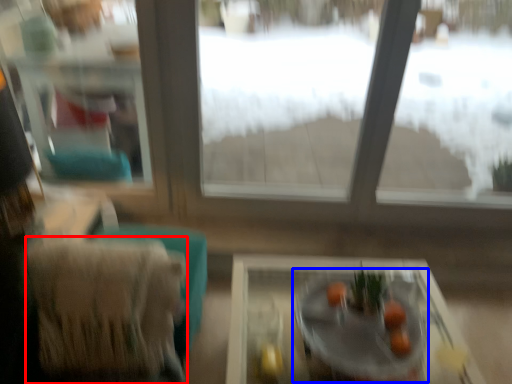
Question: Which of the following is the closest to the observer, armchair (highlighted by a red box) or round table (highlighted by a blue box)?

Choices:
 (A) armchair
 (B) round table

Answer: (B)